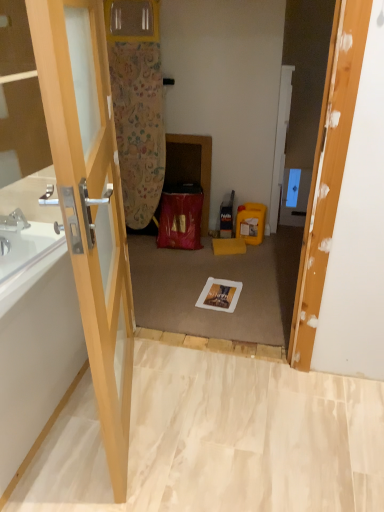
Question: From a real-world perspective, is transparent glass door at left physically located above or below white glossy bathtub at left?

Choices:
 (A) below
 (B) above

Answer: (B)

Question: Relative to white glossy bathtub at left, is transparent glass door at left in front or behind?

Choices:
 (A) front
 (B) behind

Answer: (A)

Question: Considering the positions of transparent glass door at left and white glossy bathtub at left in the image, is transparent glass door at left bigger or smaller than white glossy bathtub at left?

Choices:
 (A) small
 (B) big

Answer: (A)

Question: From the image's perspective, relative to transparent glass door at left, is white glossy bathtub at left above or below?

Choices:
 (A) below
 (B) above

Answer: (A)

Question: Choose the correct answer: Is white glossy bathtub at left inside transparent glass door at left or outside it?

Choices:
 (A) outside
 (B) inside

Answer: (A)

Question: Is white glossy bathtub at left taller or shorter than transparent glass door at left?

Choices:
 (A) short
 (B) tall

Answer: (A)

Question: In terms of width, does white glossy bathtub at left look wider or thinner when compared to transparent glass door at left?

Choices:
 (A) thin
 (B) wide

Answer: (B)